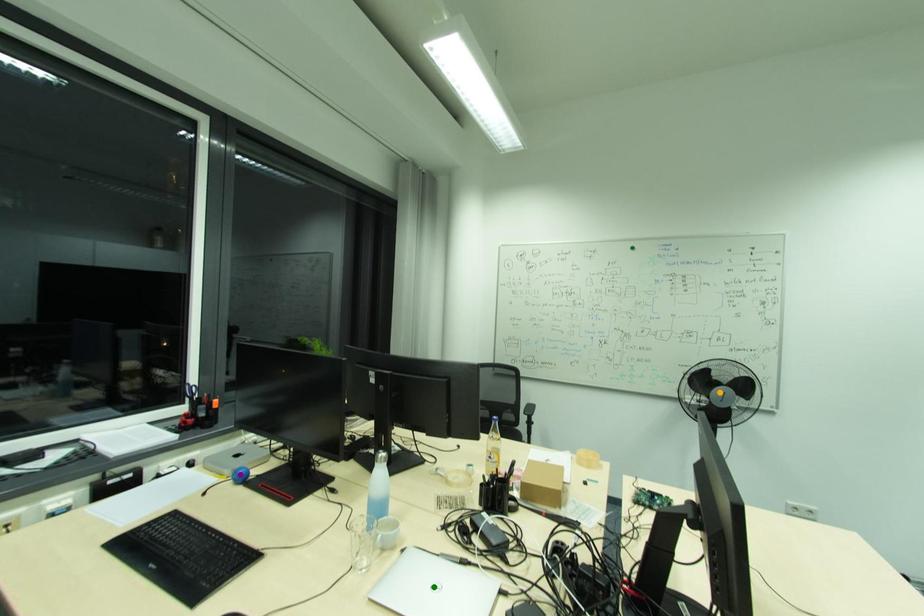
Order these from nearest to farthest:
green point
purple point
orange point

green point, purple point, orange point